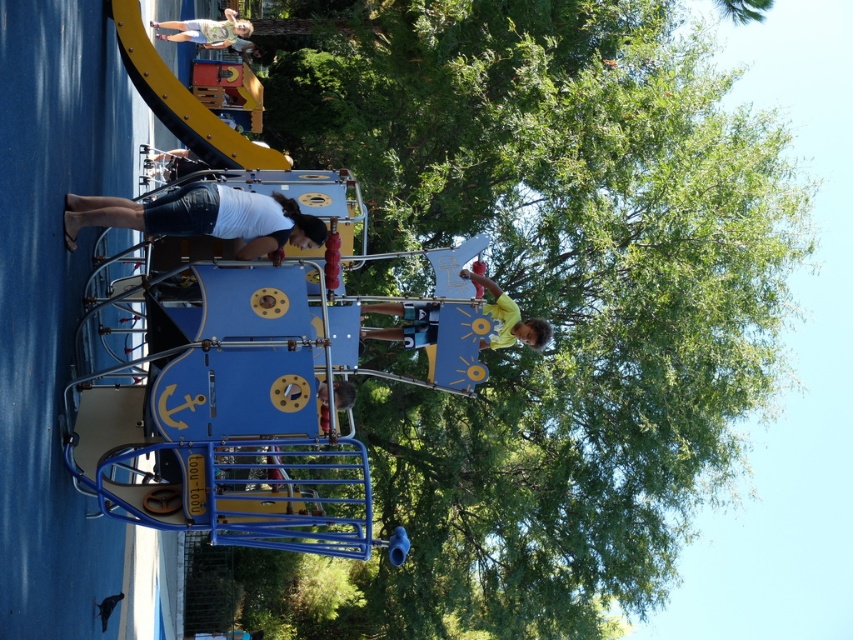
You are a parent at the playground. You see the metallic blue ship at center and the white cotton shorts at lower left. Which object is closer to you?

The metallic blue ship at center is closer to you because it is in front of the white cotton shorts at lower left.

You are a photographer trying to capture a photo of the playground scene. You notice the white cotton shorts at lower left and the light green shirt at upper center in your frame. Which object should you adjust your focus to ensure the wider one is in the foreground?

The white cotton shorts at lower left is wider than the light green shirt at upper center, so you should focus on the white cotton shorts at lower left to ensure the wider object is in the foreground.